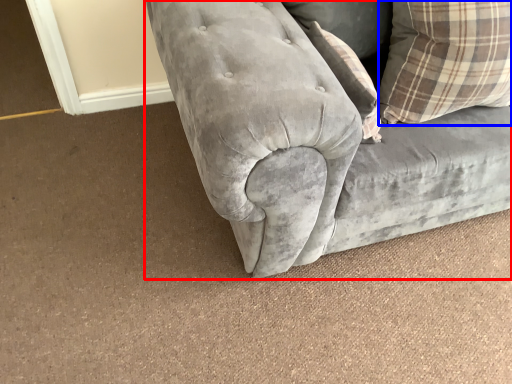
Question: Which object appears farthest to the camera in this image, studio couch (highlighted by a red box) or pillow (highlighted by a blue box)?

Choices:
 (A) studio couch
 (B) pillow

Answer: (B)